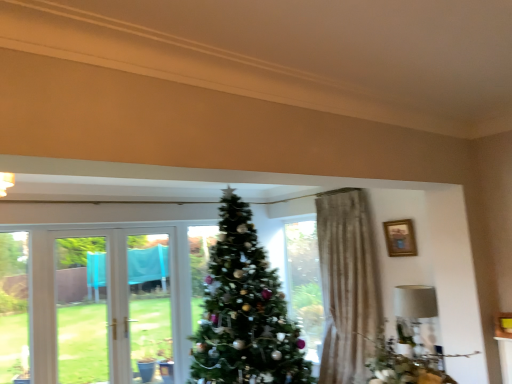
Question: Is white fabric lampshade at right in front of or behind green textured christmas tree at center in the image?

Choices:
 (A) behind
 (B) front

Answer: (A)

Question: From the image's perspective, is white fabric lampshade at right above or below green textured christmas tree at center?

Choices:
 (A) below
 (B) above

Answer: (A)

Question: Which object is positioned closest to the white fabric lampshade at right?

Choices:
 (A) wooden framed picture at upper right
 (B) green textured christmas tree at center

Answer: (A)

Question: Which is farther from the green textured christmas tree at center?

Choices:
 (A) wooden framed picture at upper right
 (B) white fabric lampshade at right

Answer: (A)